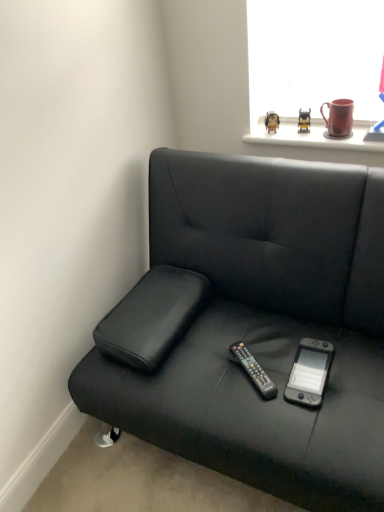
Question: From the image's perspective, would you say matte black figurine at upper center, which appears as the second toy when viewed from the right, is shown under black leather studio couch at lower left?

Choices:
 (A) no
 (B) yes

Answer: (A)

Question: Is matte black figurine at upper center, which appears as the second toy when viewed from the right, not inside black leather studio couch at lower left?

Choices:
 (A) no
 (B) yes

Answer: (B)

Question: From a real-world perspective, is matte black figurine at upper center, positioned as the 1th toy in left-to-right order, on black leather studio couch at lower left?

Choices:
 (A) yes
 (B) no

Answer: (A)

Question: Does matte black figurine at upper center, which appears as the second toy when viewed from the right, contain black leather studio couch at lower left?

Choices:
 (A) no
 (B) yes

Answer: (A)

Question: Would you consider matte black figurine at upper center, positioned as the 1th toy in left-to-right order, to be distant from black leather studio couch at lower left?

Choices:
 (A) yes
 (B) no

Answer: (B)

Question: Choose the correct answer: Is black leather studio couch at lower left inside matte black figurine at upper center, marked as the 2th toy in a left-to-right arrangement, or outside it?

Choices:
 (A) outside
 (B) inside

Answer: (A)

Question: Considering the positions of black leather studio couch at lower left and matte black figurine at upper center, the first toy from the right, in the image, is black leather studio couch at lower left taller or shorter than matte black figurine at upper center, the first toy from the right,?

Choices:
 (A) short
 (B) tall

Answer: (B)

Question: From the image's perspective, is black leather studio couch at lower left positioned above or below matte black figurine at upper center, marked as the 2th toy in a left-to-right arrangement?

Choices:
 (A) above
 (B) below

Answer: (B)

Question: Looking at their shapes, would you say black leather studio couch at lower left is wider or thinner than matte black figurine at upper center, marked as the 2th toy in a left-to-right arrangement?

Choices:
 (A) wide
 (B) thin

Answer: (A)

Question: From the image's perspective, is black plastic remote at center above or below matte black figurine at upper center, marked as the 2th toy in a left-to-right arrangement?

Choices:
 (A) below
 (B) above

Answer: (A)

Question: From a real-world perspective, is black plastic remote at center positioned above or below matte black figurine at upper center, marked as the 2th toy in a left-to-right arrangement?

Choices:
 (A) above
 (B) below

Answer: (B)

Question: In terms of size, does black plastic remote at center appear bigger or smaller than matte black figurine at upper center, the first toy from the right?

Choices:
 (A) big
 (B) small

Answer: (A)

Question: Is black plastic remote at center spatially inside matte black figurine at upper center, marked as the 2th toy in a left-to-right arrangement, or outside of it?

Choices:
 (A) inside
 (B) outside

Answer: (B)

Question: Looking at the image, does matte black figurine at upper center, marked as the 2th toy in a left-to-right arrangement, seem bigger or smaller compared to black plastic remote at center?

Choices:
 (A) small
 (B) big

Answer: (A)

Question: From a real-world perspective, is matte black figurine at upper center, the first toy from the right, positioned above or below black plastic remote at center?

Choices:
 (A) above
 (B) below

Answer: (A)